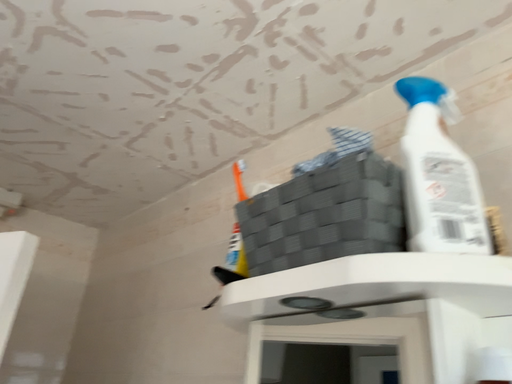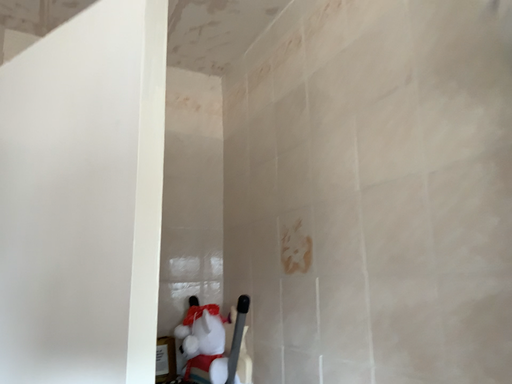
Question: Which way did the camera rotate in the video?

Choices:
 (A) rotated right
 (B) rotated left

Answer: (B)